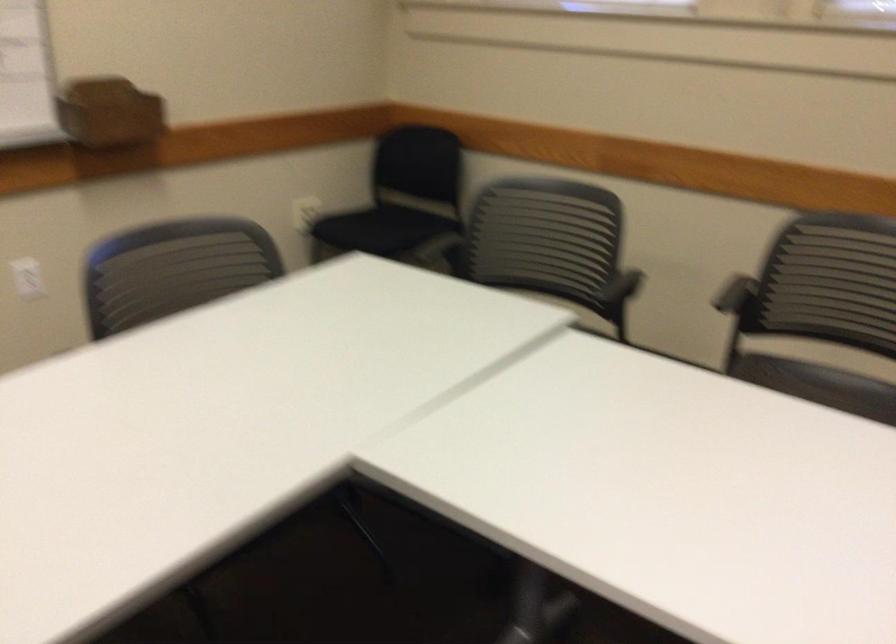
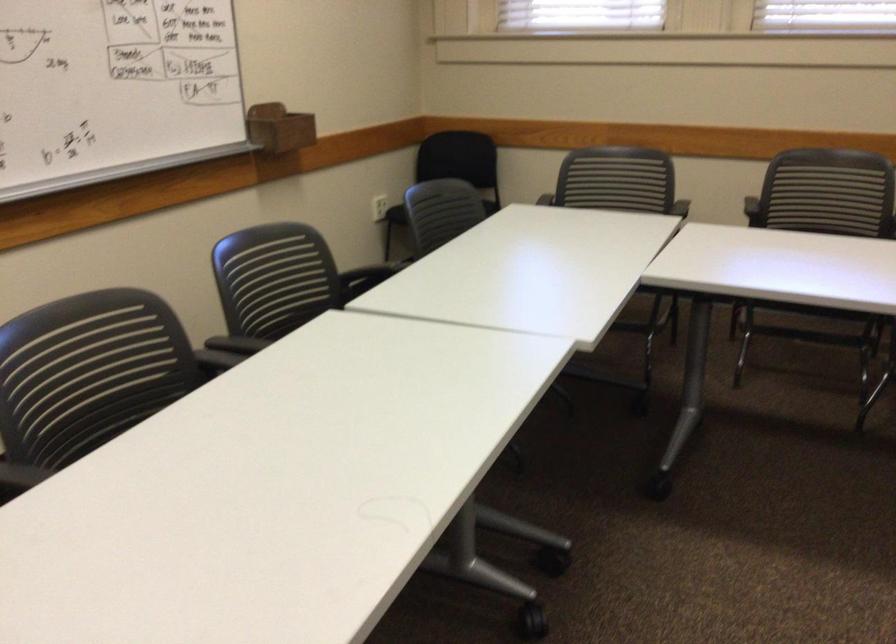
Locate, in the second image, the point that corresponds to pixel 616 304 in the first image.

(678, 212)